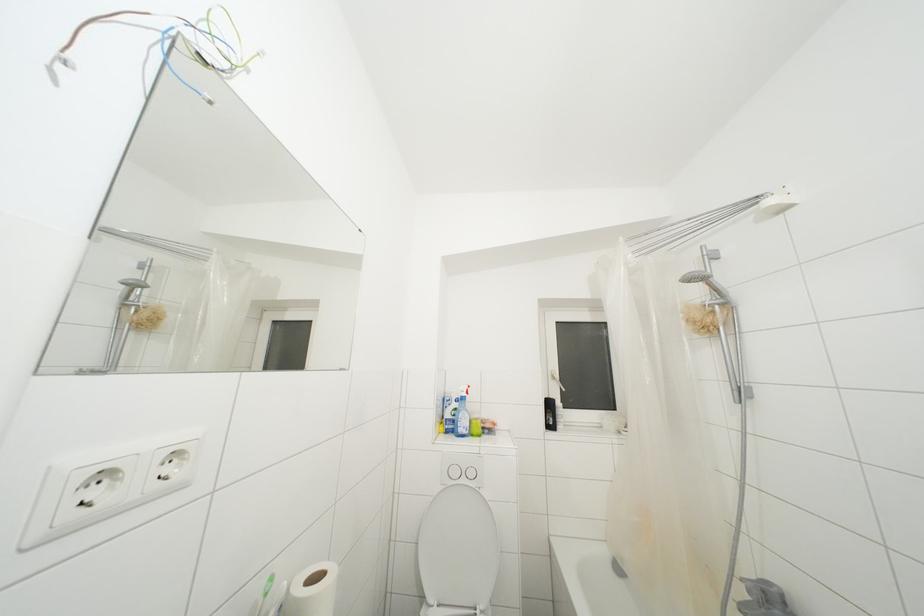
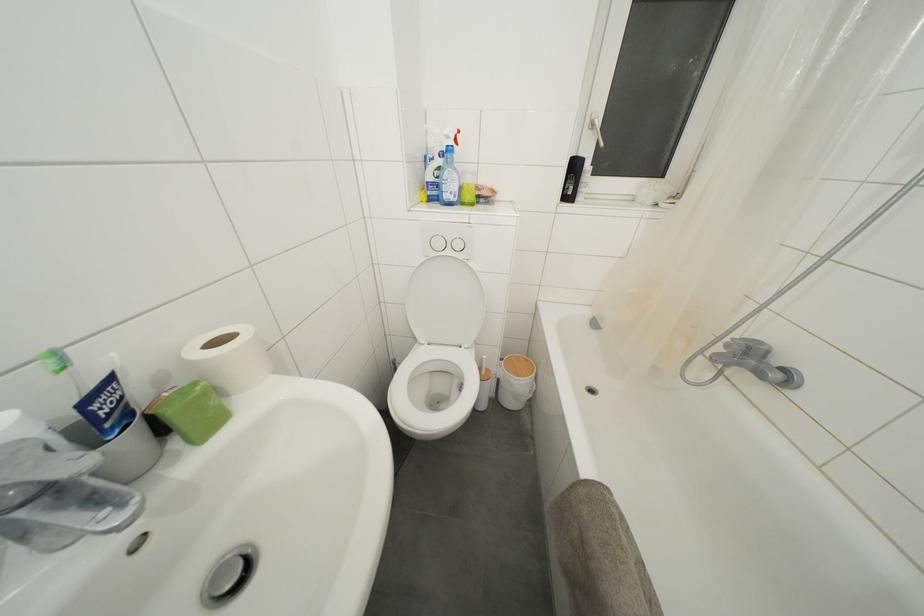
Question: I am providing you with two images of the same scene from different viewpoints. After the viewpoint changes to image2, which objects are now occluded?

Choices:
 (A) green toothbrush
 (B) shower diverter knob
 (C) wooden trash can lid
 (D) none of these

Answer: (D)